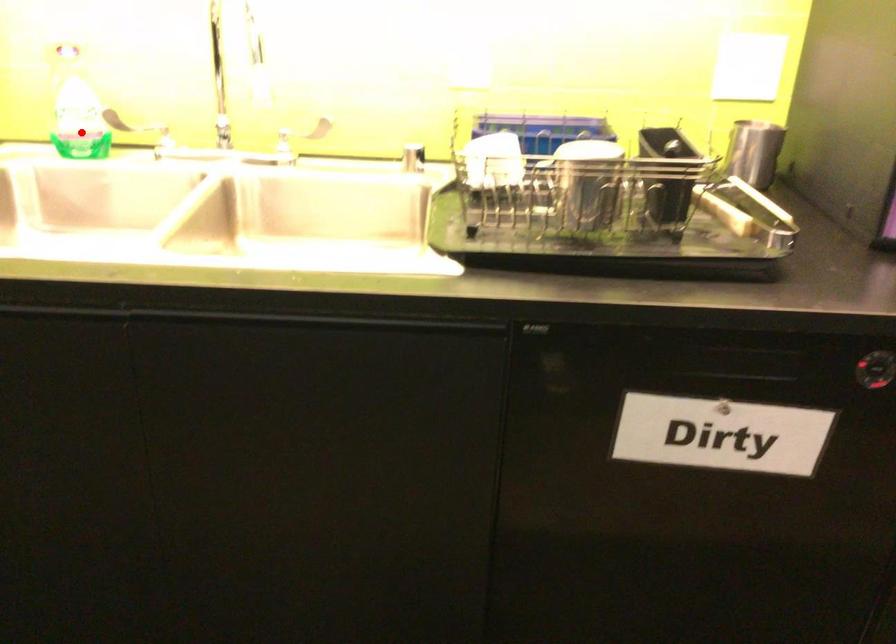
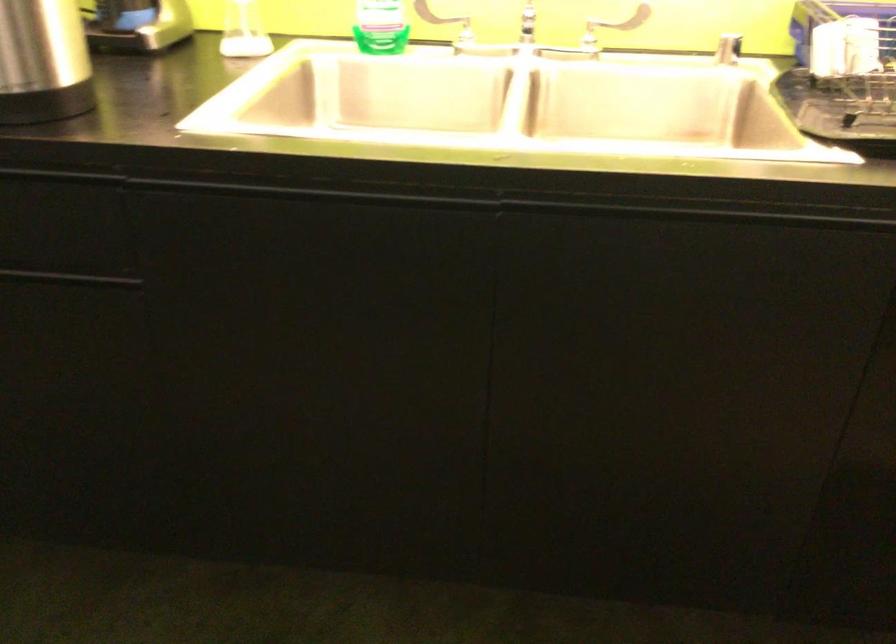
The point at the highlighted location is marked in the first image. Where is the corresponding point in the second image?

(381, 26)